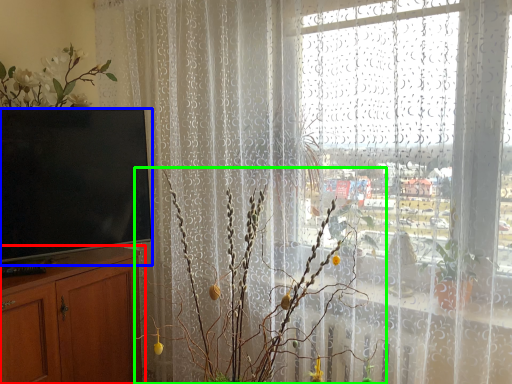
Question: Based on their relative distances, which object is nearer to cabinetry (highlighted by a red box)? Choose from television (highlighted by a blue box) and floral arrangement (highlighted by a green box).

Choices:
 (A) television
 (B) floral arrangement

Answer: (A)